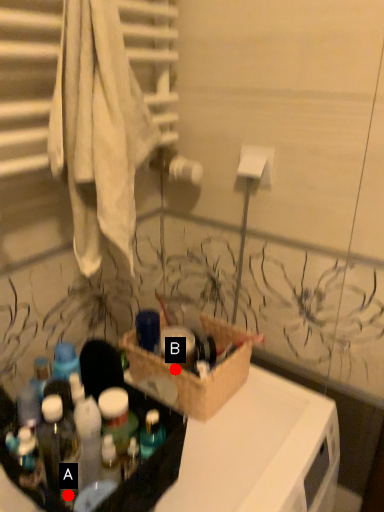
Question: Two points are circled on the image, labeled by A and B beside each circle. Among these points, which one is farthest from the camera?

Choices:
 (A) A is further
 (B) B is further

Answer: (B)